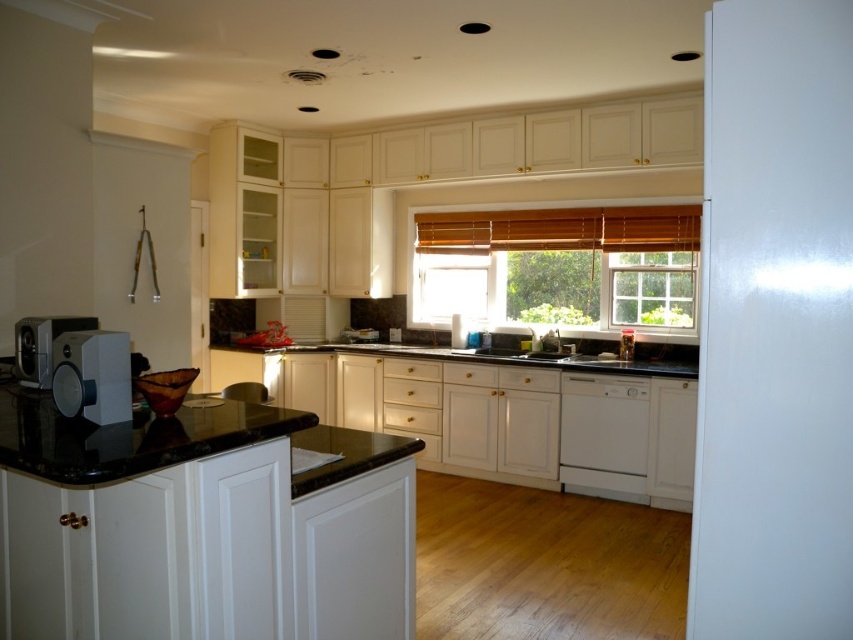
You are planning to place a new appliance in your kitchen. You have a space that can accommodate the width of the satin white toaster at left. Can the white matte dishwasher at lower center fit in that space?

The white matte dishwasher at lower center is wider than the satin white toaster at left, so it cannot fit in the space designated for the toaster.

You are planning to place a new decorative item on the kitchen counter. The item you want to place is larger than the satin white toaster at left. Based on the scene, is there enough space next to the wooden blinds at center to accommodate this new item?

The wooden blinds at center are larger than the satin white toaster at left. Since your new item is larger than the satin white toaster at left, there might be enough space next to the wooden blinds at center, but it depends on the exact dimensions of both the item and the available space.